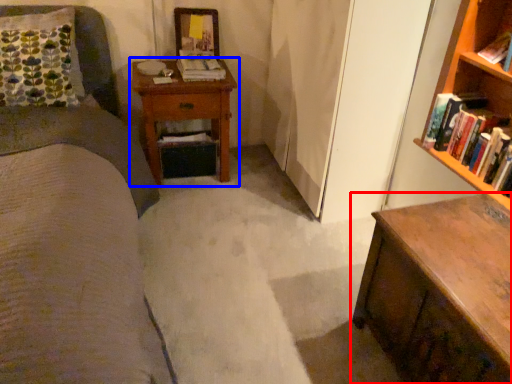
Question: Among these objects, which one is farthest to the camera, chest of drawers (highlighted by a red box) or nightstand (highlighted by a blue box)?

Choices:
 (A) chest of drawers
 (B) nightstand

Answer: (B)